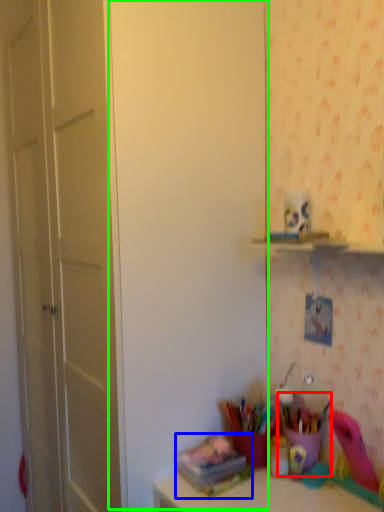
Question: Which object is the closest to the stationery (highlighted by a red box)? Choose among these: stationery (highlighted by a blue box) or door (highlighted by a green box).

Choices:
 (A) stationery
 (B) door

Answer: (A)